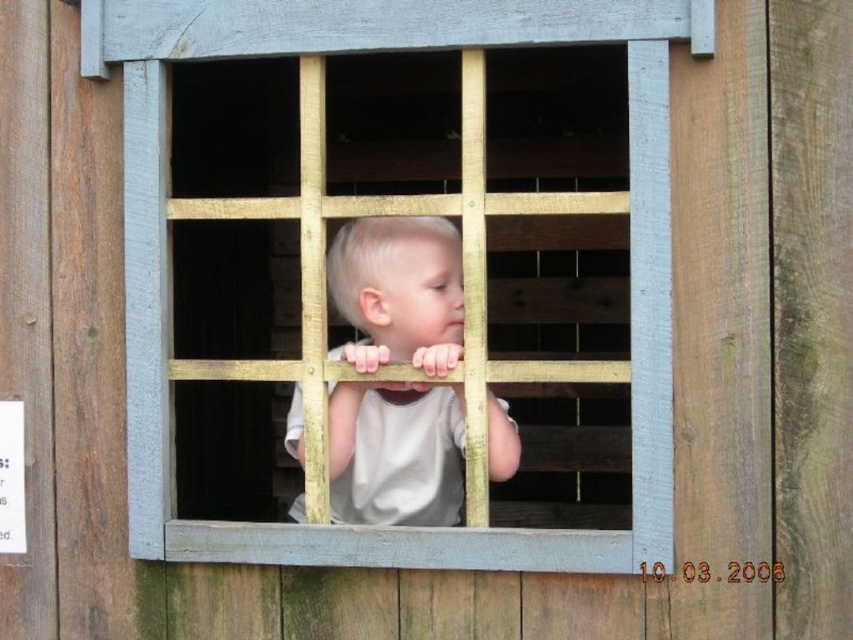
Question: Is wooden bars at center to the right of light beige fabric shirt at center from the viewer's perspective?

Choices:
 (A) no
 (B) yes

Answer: (B)

Question: Which point is closer to the camera?

Choices:
 (A) light beige fabric shirt at center
 (B) wooden bars at center

Answer: (B)

Question: Does wooden bars at center have a smaller size compared to light beige fabric shirt at center?

Choices:
 (A) no
 (B) yes

Answer: (A)

Question: Which object is closer to the camera taking this photo?

Choices:
 (A) wooden bars at center
 (B) light beige fabric shirt at center

Answer: (A)

Question: Does wooden bars at center have a larger size compared to light beige fabric shirt at center?

Choices:
 (A) yes
 (B) no

Answer: (A)